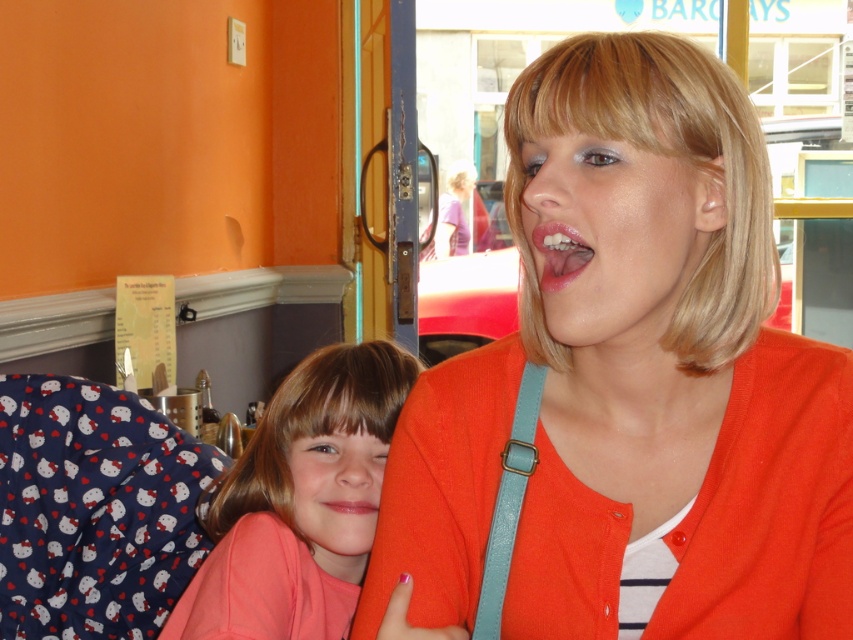
You are a photographer taking a portrait and want to ensure both the glossy pink lips at center and the pink glossy lips at center are clearly visible in the frame. Given their size difference, which one might require closer focusing to capture detail?

The glossy pink lips at center has a greater height compared to pink glossy lips at center, so it might require closer focusing to capture detail since it is larger.

You are a photographer trying to capture a closeup of the glossy pink lips at center. The camera requires a minimum focus distance of 30 inches. Can you take the photo without moving the subject?

The distance between the glossy pink lips at center and the camera is 31.56 inches, which is greater than the minimum focus distance of 30 inches. Therefore, you can take the photo without moving the subject.

Looking at this image, you are taking a photo of two people sitting at a table. You want to focus on the person closer to the camera. Which point should you adjust your camera focus to? The options are point A at coordinates point [602,332] and point B at coordinates point [360,500]. Please choose between point A or point B.

Point A at coordinates point [602,332] is closer to the camera than point B at coordinates point [360,500], so you should focus on point A.